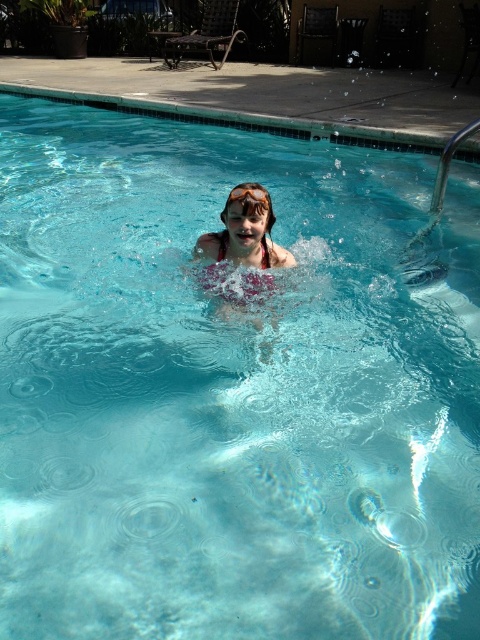
Question: Which point is farther from the camera taking this photo?

Choices:
 (A) (264, 193)
 (B) (282, 250)

Answer: (B)

Question: Does pink fabric swim cap at center have a smaller size compared to orange rubber goggles at center?

Choices:
 (A) yes
 (B) no

Answer: (B)

Question: Among these points, which one is nearest to the camera?

Choices:
 (A) 230,198
 (B) 263,212

Answer: (A)

Question: Which point is closer to the camera taking this photo?

Choices:
 (A) (211, 240)
 (B) (266, 196)

Answer: (B)

Question: Does pink fabric swim cap at center appear on the right side of orange rubber goggles at center?

Choices:
 (A) yes
 (B) no

Answer: (B)

Question: In this image, where is pink fabric swim cap at center located relative to orange rubber goggles at center?

Choices:
 (A) above
 (B) below

Answer: (B)